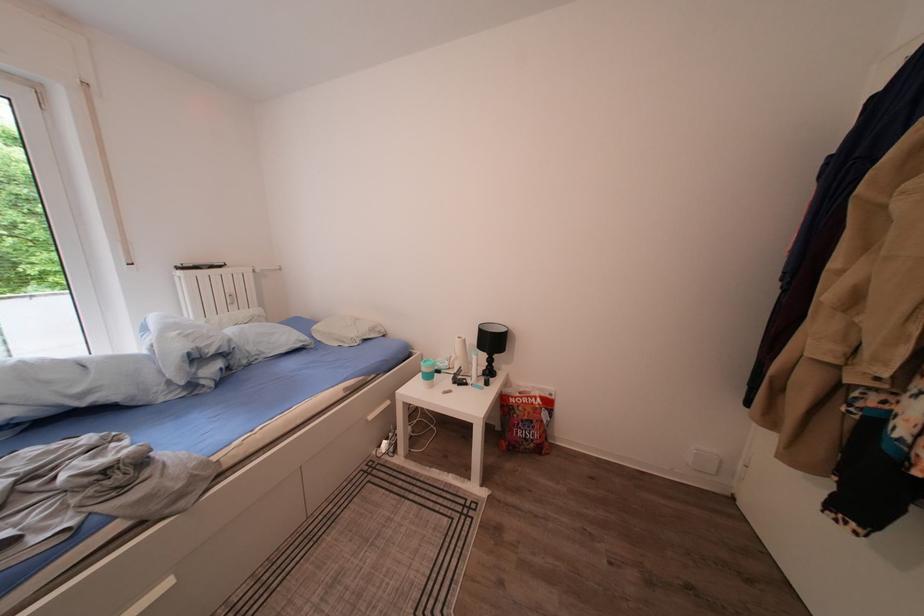
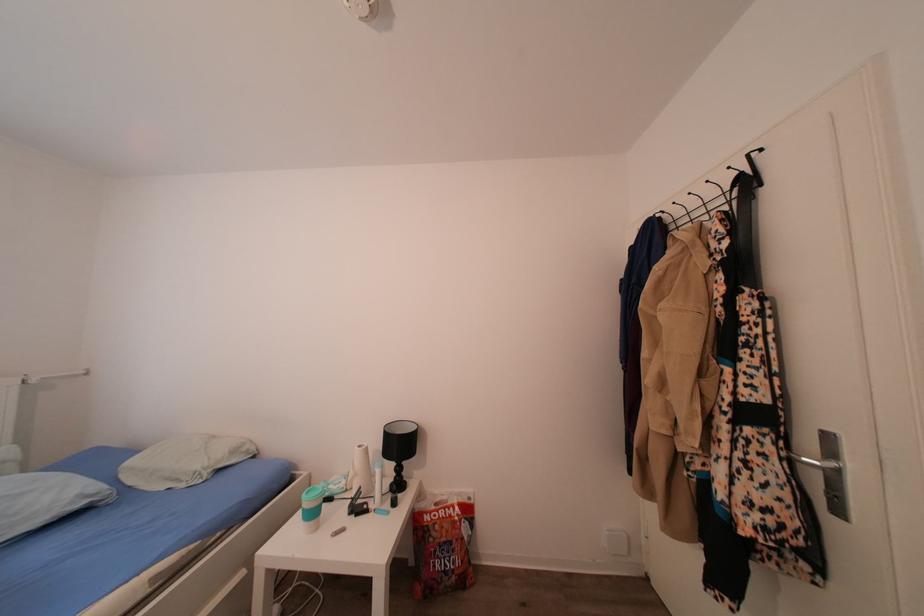
First-person continuous shooting, in which direction is the camera rotating?

The rotation direction of the camera is right-up.